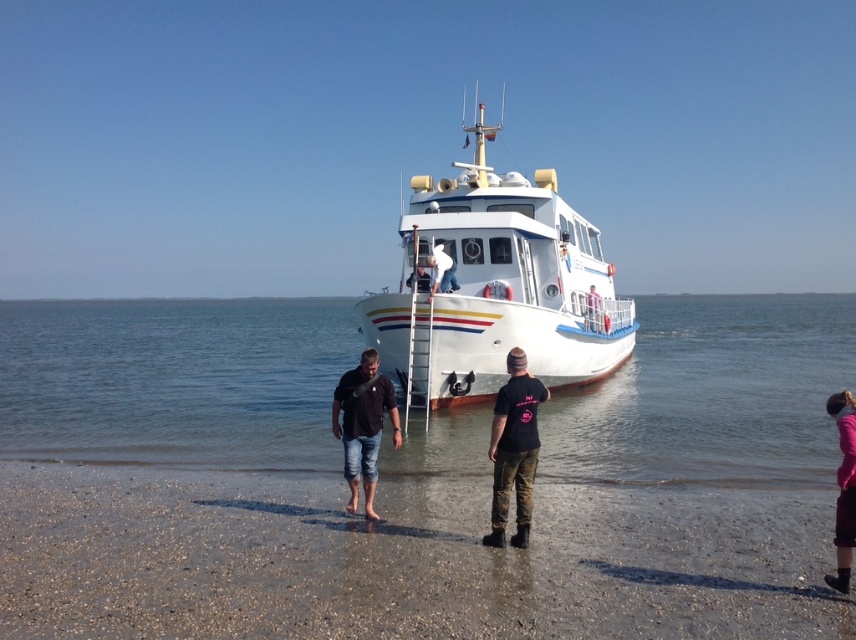
You are planning to set up a small tent for a coastal picnic. Given the presence of the smooth sand at lower center and the black denim jeans at lower center, which location would provide a more stable and spacious area for the tent?

The smooth sand at lower center has a larger size compared to the black denim jeans at lower center, so it would provide a more stable and spacious area for setting up the tent.

From the picture: You are a photographer standing at the shore and want to capture both the clear water at lower center and the black denim jeans at lower center in your photo. Which object will appear closer to the camera in the final image?

The clear water at lower center will appear closer to the camera in the final image because it is further to the viewer than the black denim jeans at lower center.

You are standing at the shoreline and want to board the white glossy boat at center. Which direction should you walk to reach it?

You should walk towards the center of the image to reach the white glossy boat at center.